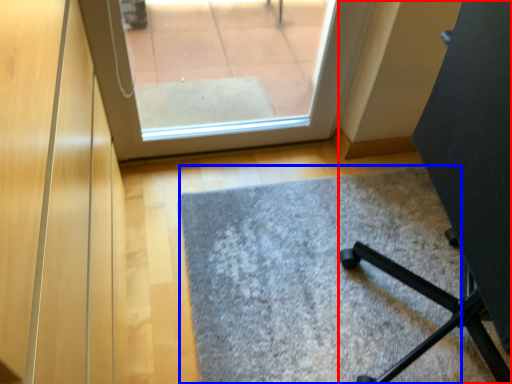
Question: Which object appears closest to the camera in this image, furniture (highlighted by a red box) or door (highlighted by a blue box)?

Choices:
 (A) furniture
 (B) door

Answer: (A)